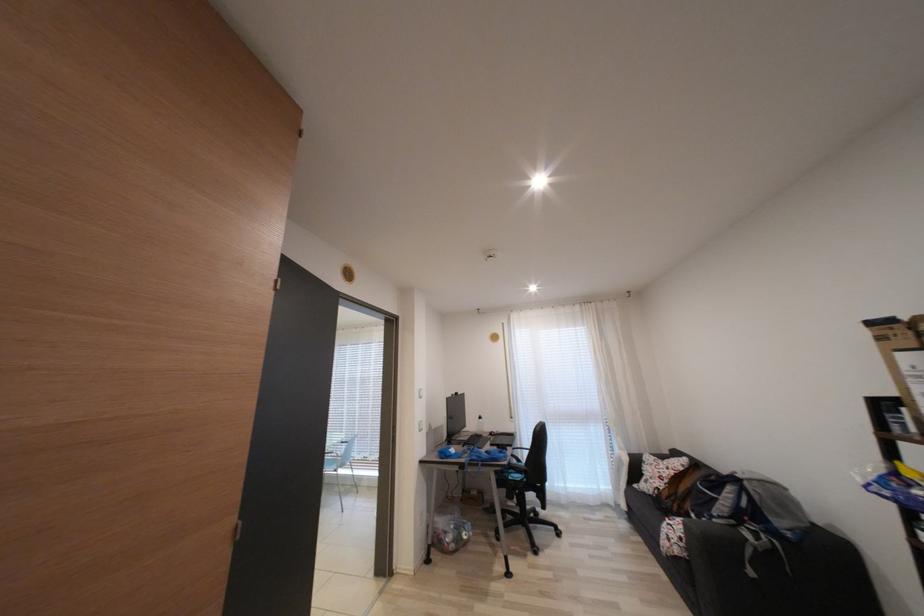
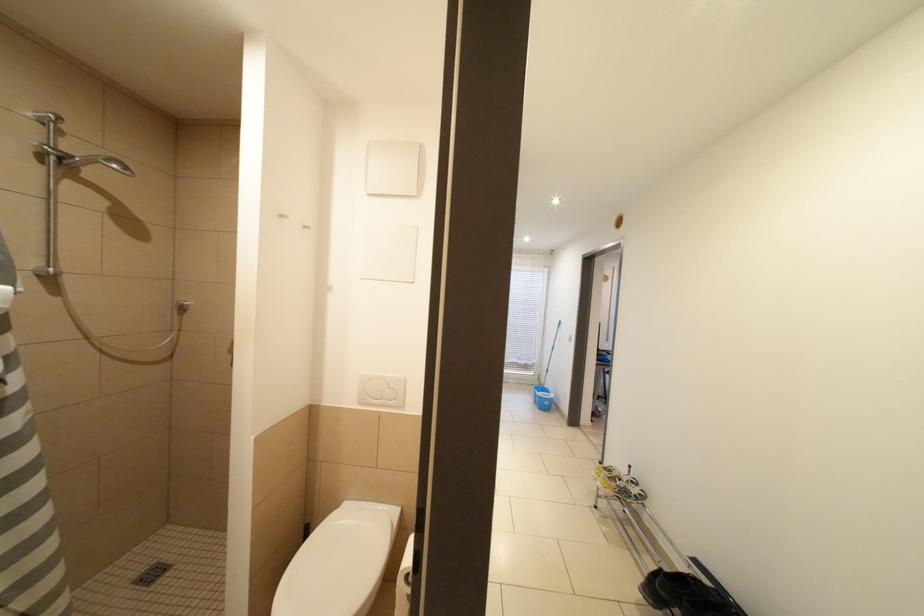
Question: The images are taken continuously from a first-person perspective. In which direction are you moving?

Choices:
 (A) Left
 (B) Right
 (C) Forward
 (D) Backward

Answer: (A)